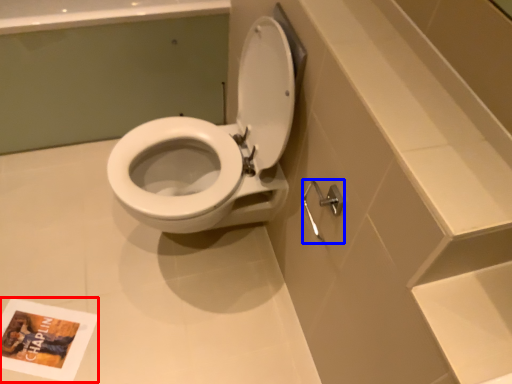
Question: Which object is further to the camera taking this photo, book cover (highlighted by a red box) or shower (highlighted by a blue box)?

Choices:
 (A) book cover
 (B) shower

Answer: (A)